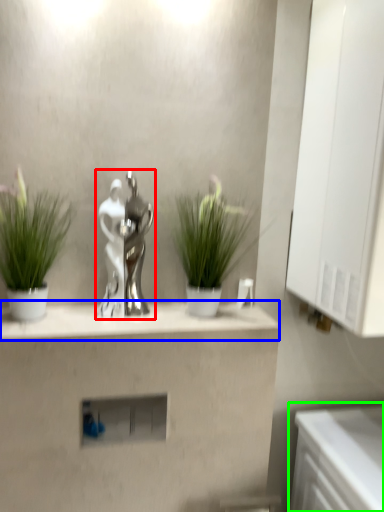
Question: Based on their relative distances, which object is farther from tap (highlighted by a red box)? Choose from mantle (highlighted by a blue box) and counter (highlighted by a green box).

Choices:
 (A) mantle
 (B) counter

Answer: (B)